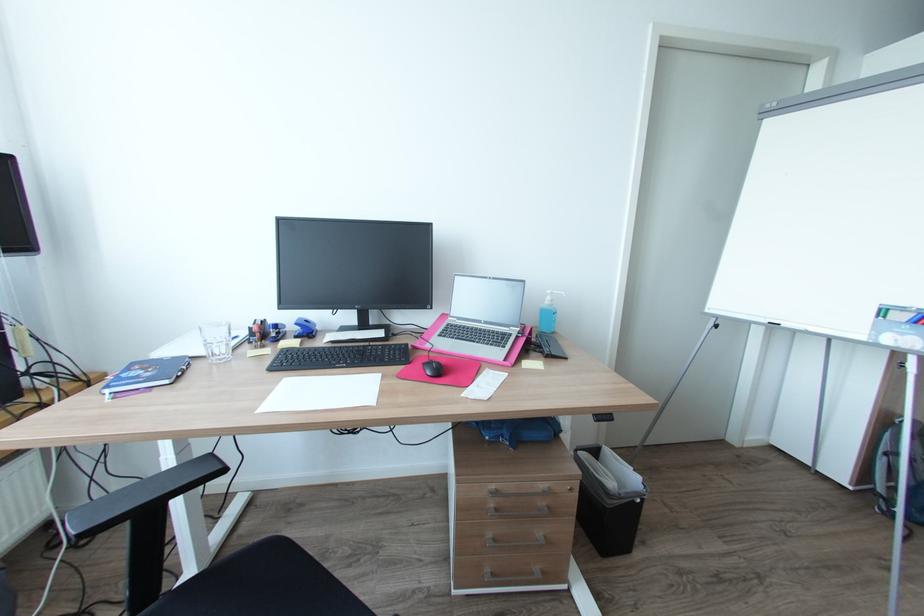
What do you see at coordinates (832, 214) in the screenshot?
I see `the red whiteboard marker` at bounding box center [832, 214].